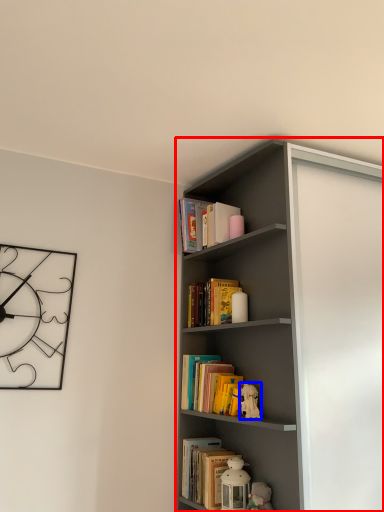
Question: Which point is further to the camera, shelf (highlighted by a red box) or toy (highlighted by a blue box)?

Choices:
 (A) shelf
 (B) toy

Answer: (B)